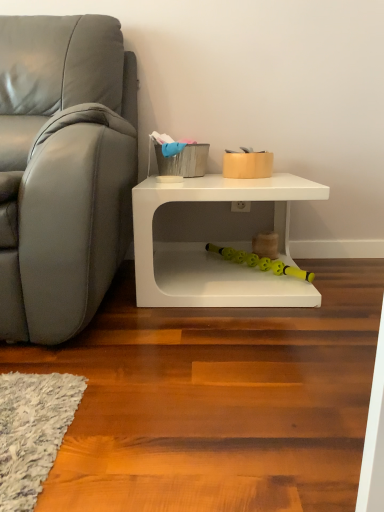
Image resolution: width=384 pixels, height=512 pixels. I want to click on free space in front of yellow rubber toy at lower center, marked as the 2th toy in a top-to-bottom arrangement, so click(258, 295).